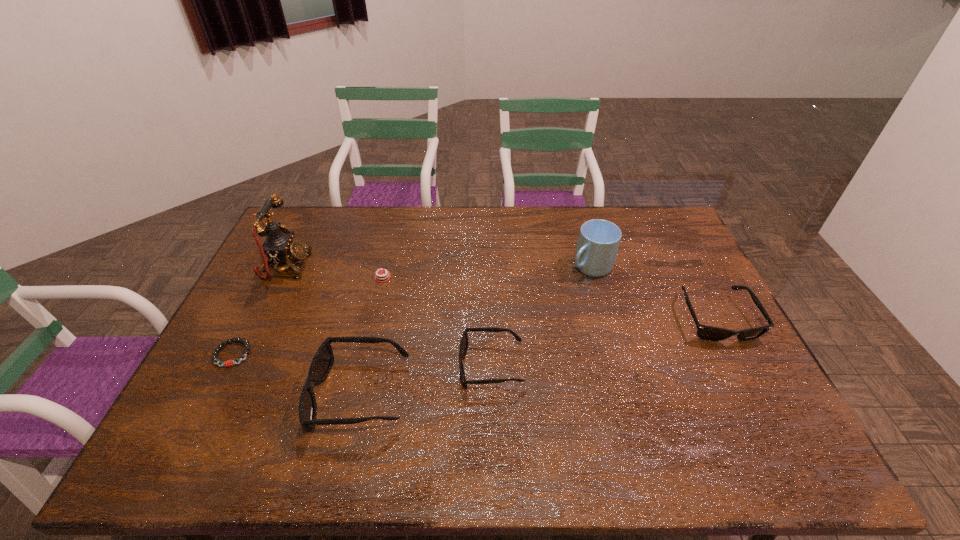
Find the location of a particular element. free region located 0.260m on the front-facing side of the leftmost sunglasses is located at coordinates (210, 394).

What are the coordinates of `vacant space located on the front-facing side of the leftmost sunglasses` in the screenshot? It's located at (285, 394).

The image size is (960, 540). Find the location of `blank space located on the front-facing side of the leftmost sunglasses`. blank space located on the front-facing side of the leftmost sunglasses is located at coordinates (194, 394).

The height and width of the screenshot is (540, 960). Find the location of `vacant position located on the front-facing side of the third object from right to left`. vacant position located on the front-facing side of the third object from right to left is located at coordinates (343, 366).

Locate an element on the screen. This screenshot has height=540, width=960. free space located on the front-facing side of the third object from right to left is located at coordinates (380, 366).

The image size is (960, 540). I want to click on vacant area situated 0.290m on the front-facing side of the third object from right to left, so click(x=350, y=366).

Where is `blank area located 0.210m on the front-facing side of the rightmost object`? blank area located 0.210m on the front-facing side of the rightmost object is located at coordinates (766, 414).

Locate an element on the screen. The width and height of the screenshot is (960, 540). vacant position located on the right of the sixth shortest object is located at coordinates (663, 267).

I want to click on free region located on the front of the tallest object, featuring the rotary dial, so click(329, 266).

What are the coordinates of `vacant area situated 0.080m on the back of the bracelet` in the screenshot? It's located at (251, 319).